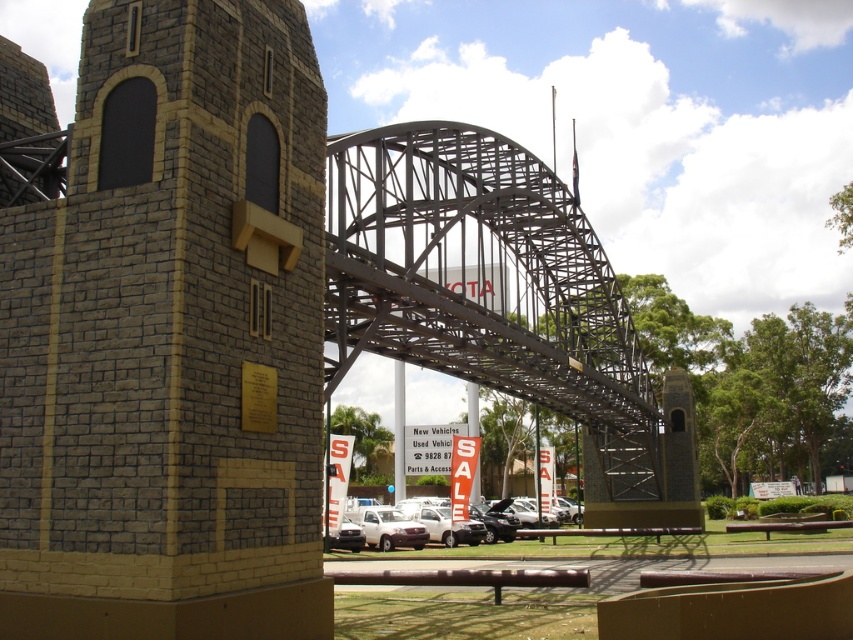
Question: Is brick textured tower at center thinner than white matte truck at center?

Choices:
 (A) no
 (B) yes

Answer: (B)

Question: Is brick textured tower at center wider than metallic gray bridge at center?

Choices:
 (A) yes
 (B) no

Answer: (B)

Question: Is brick textured tower at center above white matte truck at center?

Choices:
 (A) yes
 (B) no

Answer: (A)

Question: Which of the following is the farthest from the observer?

Choices:
 (A) (84, 452)
 (B) (386, 506)

Answer: (B)

Question: Which of these objects is positioned closest to the brick textured tower at center?

Choices:
 (A) metallic gray bridge at center
 (B) white matte truck at center

Answer: (A)

Question: Among these points, which one is farthest from the camera?

Choices:
 (A) (276, 420)
 (B) (347, 509)

Answer: (B)